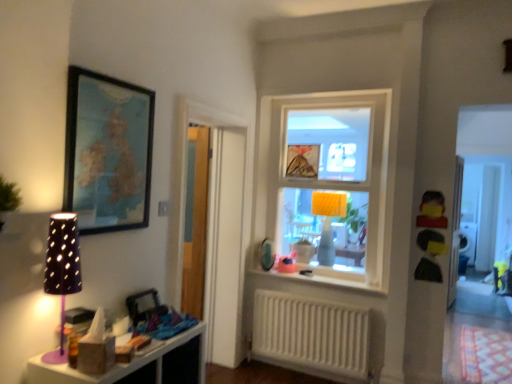
Question: Does purple matte table lamp at left, which is the first table lamp from left to right, appear on the left side of clear glass window at center?

Choices:
 (A) no
 (B) yes

Answer: (B)

Question: Considering the relative positions of purple matte table lamp at left, which is the 1th table lamp from front to back, and clear glass window at center in the image provided, is purple matte table lamp at left, which is the 1th table lamp from front to back, behind clear glass window at center?

Choices:
 (A) no
 (B) yes

Answer: (A)

Question: Does purple matte table lamp at left, which is the 1th table lamp from front to back, lie in front of clear glass window at center?

Choices:
 (A) yes
 (B) no

Answer: (A)

Question: Is purple matte table lamp at left, which is the 1th table lamp from front to back, wider than clear glass window at center?

Choices:
 (A) yes
 (B) no

Answer: (B)

Question: Does purple matte table lamp at left, which ranks as the second table lamp in back-to-front order, have a lesser height compared to clear glass window at center?

Choices:
 (A) no
 (B) yes

Answer: (B)

Question: Is matte plastic shelf at lower left wider or thinner than white plastic radiator at lower center?

Choices:
 (A) thin
 (B) wide

Answer: (B)

Question: Would you say matte plastic shelf at lower left is to the left or to the right of white plastic radiator at lower center in the picture?

Choices:
 (A) left
 (B) right

Answer: (A)

Question: Which is correct: matte plastic shelf at lower left is inside white plastic radiator at lower center, or outside of it?

Choices:
 (A) outside
 (B) inside

Answer: (A)

Question: From the image's perspective, is matte plastic shelf at lower left above or below white plastic radiator at lower center?

Choices:
 (A) above
 (B) below

Answer: (A)

Question: From a real-world perspective, relative to white glossy window sill at center, is wooden framed map at upper left vertically above or below?

Choices:
 (A) above
 (B) below

Answer: (A)

Question: From their relative heights in the image, would you say wooden framed map at upper left is taller or shorter than white glossy window sill at center?

Choices:
 (A) tall
 (B) short

Answer: (A)

Question: Based on their positions, is wooden framed map at upper left located to the left or right of white glossy window sill at center?

Choices:
 (A) left
 (B) right

Answer: (A)

Question: Do you think wooden framed map at upper left is within white glossy window sill at center, or outside of it?

Choices:
 (A) outside
 (B) inside

Answer: (A)

Question: From their relative heights in the image, would you say matte plastic toy at center, which appears as the second toy when viewed from the right, is taller or shorter than clear glass window at center?

Choices:
 (A) short
 (B) tall

Answer: (A)

Question: Considering the positions of point 287,269 and point 348,226, is point 287,269 closer or farther from the camera than point 348,226?

Choices:
 (A) closer
 (B) farther

Answer: (B)